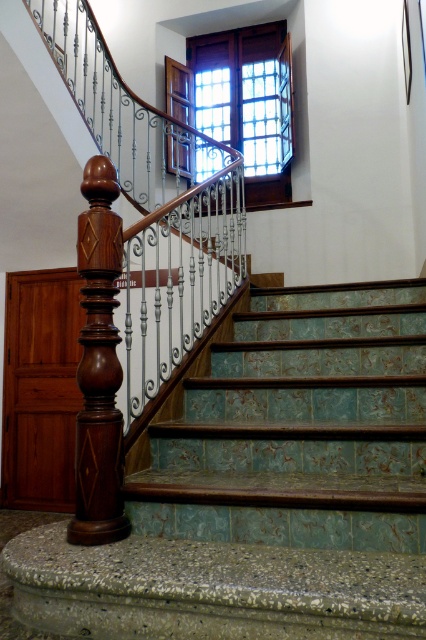
What do you see at coordinates (299, 428) in the screenshot?
I see `green textured tile stairs at center` at bounding box center [299, 428].

Does point (267, 376) come farther from viewer compared to point (232, 81)?

No, (267, 376) is in front of (232, 81).

Find the location of a particular element. The height and width of the screenshot is (640, 426). green textured tile stairs at center is located at coordinates (299, 428).

Does point (104, 422) lie in front of point (215, 84)?

Yes, point (104, 422) is in front of point (215, 84).

Between point (103, 337) and point (247, 38), which one is positioned behind?

The point (247, 38) is behind.

Find the location of a particular element. polished wood post at center is located at coordinates (98, 364).

Looking at this image, is green textured tile stairs at center thinner than polished wood post at center?

Incorrect, green textured tile stairs at center's width is not less than polished wood post at center's.

Does green textured tile stairs at center appear under polished wood post at center?

Yes, green textured tile stairs at center is below polished wood post at center.

What are the coordinates of `green textured tile stairs at center` in the screenshot? It's located at (299, 428).